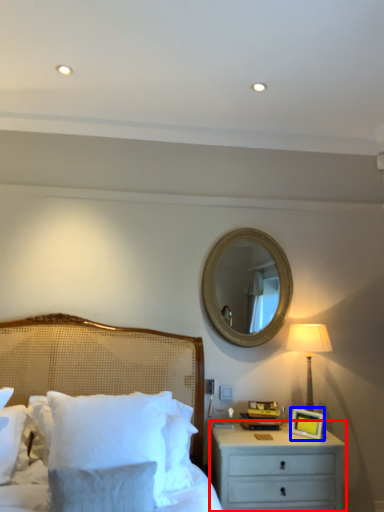
Question: Which object appears farthest to the camera in this image, nightstand (highlighted by a red box) or picture frame (highlighted by a blue box)?

Choices:
 (A) nightstand
 (B) picture frame

Answer: (B)